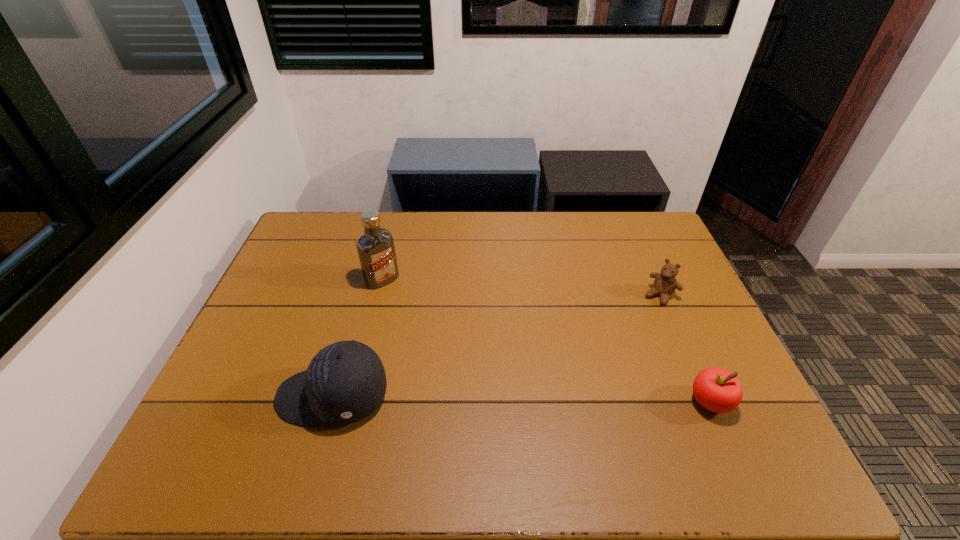
Where is `vacant space that's between the teddy bear and the apple`? vacant space that's between the teddy bear and the apple is located at coordinates (684, 349).

The image size is (960, 540). I want to click on free area in between the teddy bear and the apple, so click(x=684, y=349).

Where is `unoccupied area between the apple and the tallest object`? unoccupied area between the apple and the tallest object is located at coordinates (546, 341).

The width and height of the screenshot is (960, 540). Identify the location of vacant area between the baseball cap and the tallest object. (357, 338).

This screenshot has height=540, width=960. I want to click on vacant area that lies between the teddy bear and the apple, so [684, 349].

Identify the location of free spot between the vodka and the teddy bear. (521, 287).

You are a GUI agent. You are given a task and a screenshot of the screen. Output one action in this format:
    pyautogui.click(x=<x>, y=<y>)
    Task: Click on the vacant space that's between the apple and the third shortest object
    
    Given the screenshot: What is the action you would take?
    pyautogui.click(x=521, y=399)

Where is `vacant space that's between the vodka and the teddy bear`? Image resolution: width=960 pixels, height=540 pixels. vacant space that's between the vodka and the teddy bear is located at coordinates (521, 287).

Identify which object is the third closest to the second tallest object. Please provide its 2D coordinates. Your answer should be formatted as a tuple, i.e. [(x, y)], where the tuple contains the x and y coordinates of a point satisfying the conditions above.

[(665, 283)]

Identify which object is the third closest to the second tallest object. Please provide its 2D coordinates. Your answer should be formatted as a tuple, i.e. [(x, y)], where the tuple contains the x and y coordinates of a point satisfying the conditions above.

[(665, 283)]